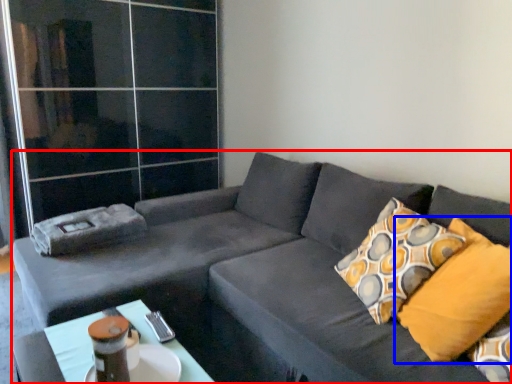
Question: Among these objects, which one is nearest to the camera, studio couch (highlighted by a red box) or pillow (highlighted by a blue box)?

Choices:
 (A) studio couch
 (B) pillow

Answer: (A)